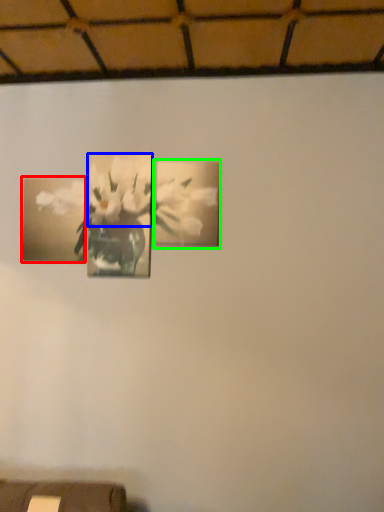
Question: Which object is the closest to the picture frame (highlighted by a red box)? Choose among these: flower (highlighted by a blue box) or picture frame (highlighted by a green box).

Choices:
 (A) flower
 (B) picture frame

Answer: (A)